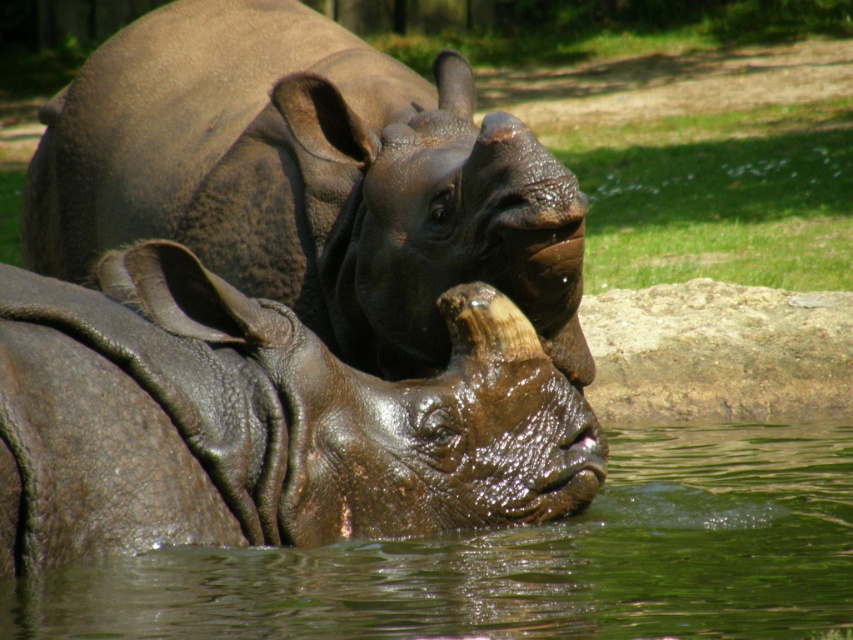
Question: Which point is farther from the camera taking this photo?

Choices:
 (A) (746, 531)
 (B) (241, 378)

Answer: (A)

Question: Which point is closer to the camera?

Choices:
 (A) (751, 582)
 (B) (532, 147)

Answer: (A)

Question: Is leather-like dark brown rhinoceros at center behind wet brown rhinoceros at center?

Choices:
 (A) no
 (B) yes

Answer: (B)

Question: Is wet brown rhinoceros at center further to camera compared to green liquid water at lower center?

Choices:
 (A) no
 (B) yes

Answer: (A)

Question: Is leather-like dark brown rhinoceros at center thinner than green liquid water at lower center?

Choices:
 (A) yes
 (B) no

Answer: (B)

Question: Among these objects, which one is nearest to the camera?

Choices:
 (A) green liquid water at lower center
 (B) leather-like dark brown rhinoceros at center
 (C) wet brown rhinoceros at center

Answer: (C)